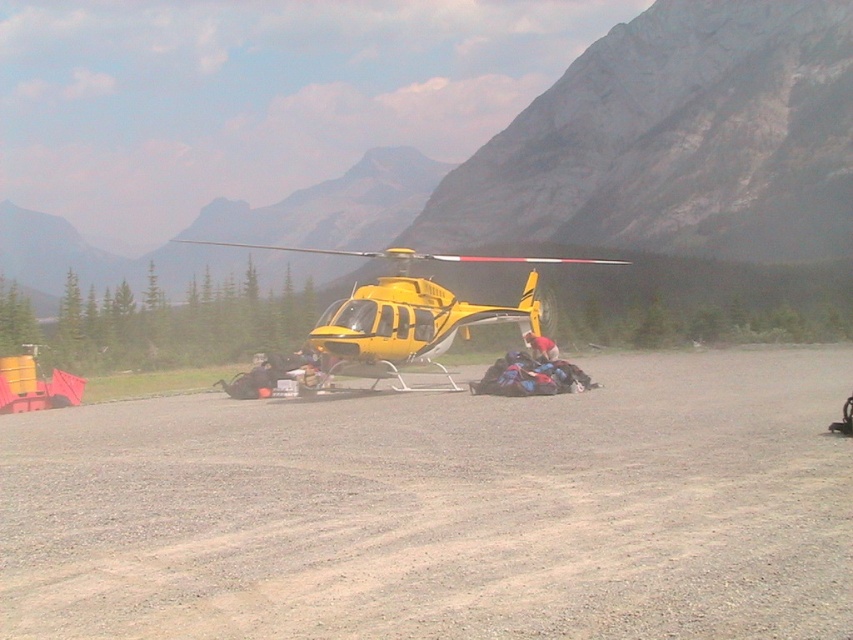
Question: Which point is closer to the camera taking this photo?

Choices:
 (A) (840, 140)
 (B) (543, 358)
 (C) (114, 548)
 (D) (381, 296)

Answer: (C)

Question: Which object is the farthest from the yellow matte helicopter at center?

Choices:
 (A) red fabric bag at center
 (B) gray gravel dirt track at center
 (C) rocky mountain at center
 (D) blue fabric bags at center

Answer: (A)

Question: Is rocky mountain at center further to camera compared to red fabric bag at center?

Choices:
 (A) no
 (B) yes

Answer: (B)

Question: Where is gray gravel dirt track at center located in relation to rocky mountain at center in the image?

Choices:
 (A) above
 (B) below

Answer: (B)

Question: Which point is farther from the camera taking this photo?

Choices:
 (A) (749, 124)
 (B) (613, 396)
 (C) (341, 301)

Answer: (A)

Question: Observing the image, what is the correct spatial positioning of gray gravel dirt track at center in reference to blue fabric bags at center?

Choices:
 (A) right
 (B) left

Answer: (B)